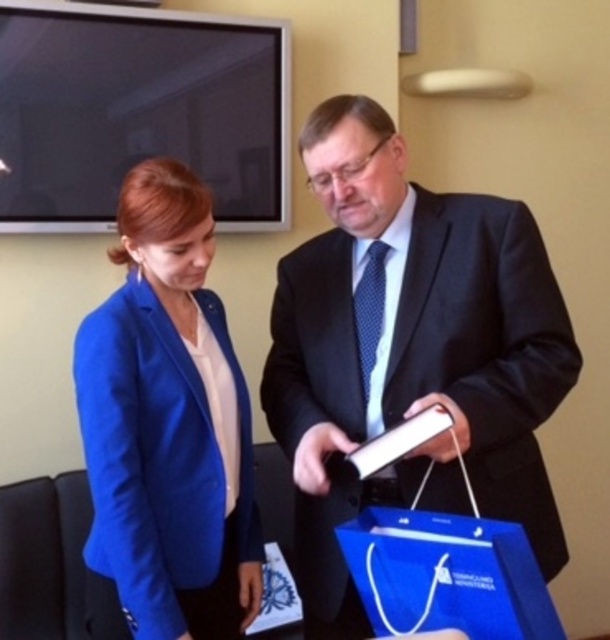
Looking at this image, who is shorter, matte black suit at center or blue fabric jacket at left?

blue fabric jacket at left is shorter.

Between point (553, 352) and point (101, 397), which one is positioned in front?

Point (101, 397) is in front.

Is point (462, 291) positioned in front of point (127, 589)?

That is False.

At what (x,y) coordinates should I click in order to perform the action: click on matte black suit at center. Please return your answer as a coordinate pair (x, y). The height and width of the screenshot is (640, 610). Looking at the image, I should click on (409, 352).